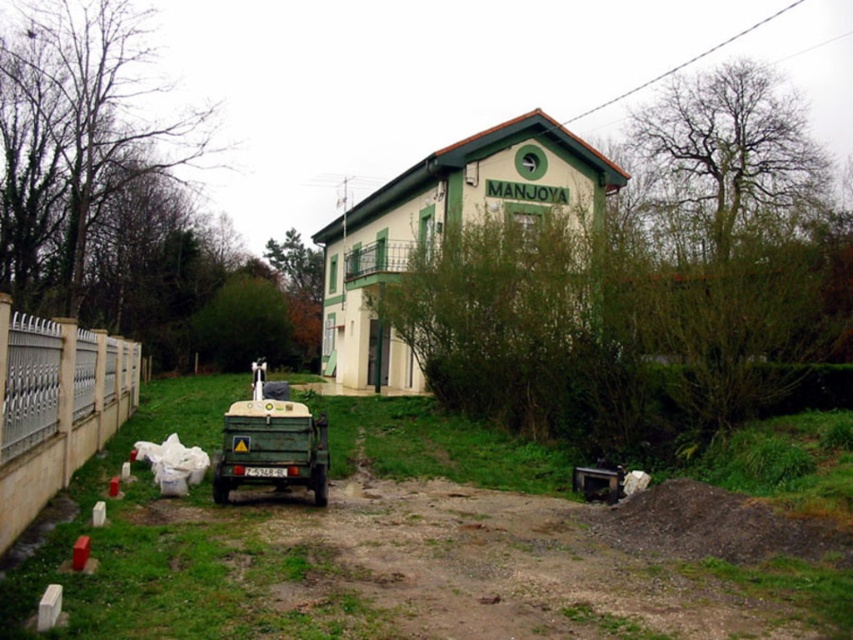
You are standing on the dirt path leading to the building. You see a white metal fence at lower left and a green matte truck at lower left. Which object is closer to you as you face the building?

The white metal fence at lower left is closer to you because it is in front of the green matte truck at lower left.